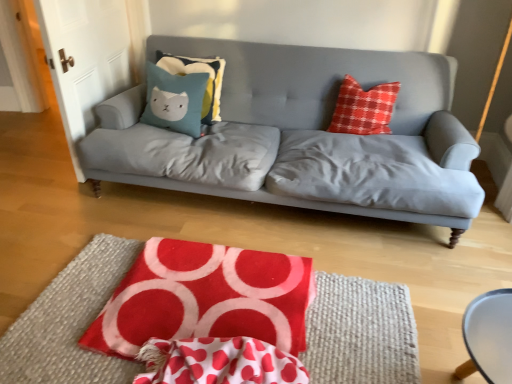
What do you see at coordinates (205, 298) in the screenshot? Image resolution: width=512 pixels, height=384 pixels. I see `red velvety quilt at lower center` at bounding box center [205, 298].

Locate an element on the screen. Image resolution: width=512 pixels, height=384 pixels. red velvety quilt at lower center is located at coordinates (205, 298).

Which is in front, point (233, 360) or point (500, 364)?

The point (500, 364) is more forward.

From a real-world perspective, is red polka dot fabric at center above or below smooth white table at lower right?

red polka dot fabric at center is below smooth white table at lower right.

Which of these two, red polka dot fabric at center or smooth white table at lower right, is thinner?

With smaller width is red polka dot fabric at center.

From their relative heights in the image, would you say red felt rug at center is taller or shorter than smooth white table at lower right?

In the image, red felt rug at center appears to be shorter than smooth white table at lower right.

Is red felt rug at center facing towards smooth white table at lower right?

No, red felt rug at center is not facing towards smooth white table at lower right.

Is red felt rug at center located outside smooth white table at lower right?

Yes, red felt rug at center is not within smooth white table at lower right.

Looking at their sizes, would you say red plaid pillow at upper right is wider or thinner than red polka dot fabric at center?

In the image, red plaid pillow at upper right appears to be wider than red polka dot fabric at center.

Is the position of red plaid pillow at upper right more distant than that of red polka dot fabric at center?

Yes, red plaid pillow at upper right is further from the viewer.

Is point (372, 129) closer or farther from the camera than point (244, 372)?

Point (372, 129) is farther from the camera than point (244, 372).

Can you see smooth white table at lower right touching red plaid pillow at upper right?

No, smooth white table at lower right is not in contact with red plaid pillow at upper right.

Considering the relative sizes of smooth white table at lower right and red plaid pillow at upper right in the image provided, is smooth white table at lower right shorter than red plaid pillow at upper right?

Correct, smooth white table at lower right is not as tall as red plaid pillow at upper right.

Between point (480, 298) and point (343, 117), which one is positioned in front?

The point (480, 298) is more forward.

How distant is smooth white table at lower right from red plaid pillow at upper right?

smooth white table at lower right is 4.66 feet from red plaid pillow at upper right.

Considering the relative positions of red velvety quilt at lower center and teal fabric pillow with cat design at center, placed as the second pillow when sorted from front to back, in the image provided, is red velvety quilt at lower center to the left or to the right of teal fabric pillow with cat design at center, placed as the second pillow when sorted from front to back,?

Clearly, red velvety quilt at lower center is on the right of teal fabric pillow with cat design at center, placed as the second pillow when sorted from front to back, in the image.

Consider the image. Is red velvety quilt at lower center closer to camera compared to teal fabric pillow with cat design at center, which appears as the 1th pillow when viewed from the back?

Yes, the depth of red velvety quilt at lower center is less than that of teal fabric pillow with cat design at center, which appears as the 1th pillow when viewed from the back.

From a real-world perspective, is red velvety quilt at lower center located beneath teal fabric pillow with cat design at center, placed as the second pillow when sorted from front to back?

Yes.

Which of these two, red polka dot fabric at center or red velvety quilt at lower center, stands shorter?

With less height is red velvety quilt at lower center.

Which point is more forward, (293,363) or (232,262)?

Positioned in front is point (293,363).

Is red velvety quilt at lower center inside red polka dot fabric at center?

No.

Is red plaid pillow at upper right turned away from teal fabric pillow with cat design at center, which appears as the 1th pillow when viewed from the back?

red plaid pillow at upper right does not have its back to teal fabric pillow with cat design at center, which appears as the 1th pillow when viewed from the back.

From the picture: Measure the distance from red plaid pillow at upper right to teal fabric pillow with cat design at center, placed as the second pillow when sorted from front to back.

red plaid pillow at upper right and teal fabric pillow with cat design at center, placed as the second pillow when sorted from front to back, are 35.76 inches apart from each other.

Is red plaid pillow at upper right further to camera compared to teal fabric pillow with cat design at center, placed as the second pillow when sorted from front to back?

No.

From the picture: Considering the sizes of objects red plaid pillow at upper right and teal fabric pillow with cat design at center, placed as the second pillow when sorted from front to back, in the image provided, who is bigger, red plaid pillow at upper right or teal fabric pillow with cat design at center, placed as the second pillow when sorted from front to back,?

teal fabric pillow with cat design at center, placed as the second pillow when sorted from front to back.

There is a red polka dot fabric at center. Where is `round table above it (from a real-world perspective)`? The width and height of the screenshot is (512, 384). round table above it (from a real-world perspective) is located at coordinates (488, 337).

This screenshot has height=384, width=512. What are the coordinates of `round table that appears on the right of red felt rug at center` in the screenshot? It's located at pos(488,337).

From the image, which object appears to be farther from red felt rug at center, teal fabric pillow with cat design at center, placed as the second pillow when sorted from front to back, or smooth white table at lower right?

Based on the image, smooth white table at lower right appears to be further to red felt rug at center.

From the picture: Based on their spatial positions, is red plaid pillow at upper right or teal fabric pillow with cat design at center, which appears as the 1th pillow when viewed from the back, closer to smooth white table at lower right?

The object closer to smooth white table at lower right is red plaid pillow at upper right.

Estimate the real-world distances between objects in this image. Which object is closer to teal fabric pillow with cat design at center, placed as the second pillow when sorted from front to back, red felt rug at center or teal plush pillow at center-left, acting as the 1th pillow starting from the front?

teal plush pillow at center-left, acting as the 1th pillow starting from the front.

When comparing their distances from teal fabric pillow with cat design at center, placed as the second pillow when sorted from front to back, does smooth white table at lower right or red plaid pillow at upper right seem closer?

The object closer to teal fabric pillow with cat design at center, placed as the second pillow when sorted from front to back, is red plaid pillow at upper right.

Considering their positions, is teal fabric pillow with cat design at center, placed as the second pillow when sorted from front to back, positioned further to smooth white table at lower right than red plaid pillow at upper right?

teal fabric pillow with cat design at center, placed as the second pillow when sorted from front to back, lies further to smooth white table at lower right than the other object.

Looking at the image, which one is located closer to teal fabric pillow with cat design at center, which appears as the 1th pillow when viewed from the back, matte gray couch at center or red plaid pillow at upper right?

matte gray couch at center.

Based on their spatial positions, is red velvety quilt at lower center or teal fabric pillow with cat design at center, which appears as the 1th pillow when viewed from the back, closer to red polka dot fabric at center?

red velvety quilt at lower center.

Considering their positions, is red velvety quilt at lower center positioned closer to red polka dot fabric at center than red plaid pillow at upper right?

Based on the image, red velvety quilt at lower center appears to be nearer to red polka dot fabric at center.

Identify the location of pillow that lies between teal fabric pillow with cat design at center, placed as the second pillow when sorted from front to back, and red velvety quilt at lower center from top to bottom. (174, 100).

The height and width of the screenshot is (384, 512). In order to click on plain between red velvety quilt at lower center and red polka dot fabric at center in the vertical direction in this screenshot , I will do `click(69, 322)`.

Locate an element on the screen. quilt between smooth white table at lower right and teal fabric pillow with cat design at center, placed as the second pillow when sorted from front to back, from front to back is located at coordinates click(x=205, y=298).

Image resolution: width=512 pixels, height=384 pixels. In order to click on studio couch situated between teal plush pillow at center-left, acting as the 1th pillow starting from the front, and red plaid pillow at upper right from left to right in this screenshot , I will do `click(298, 126)`.